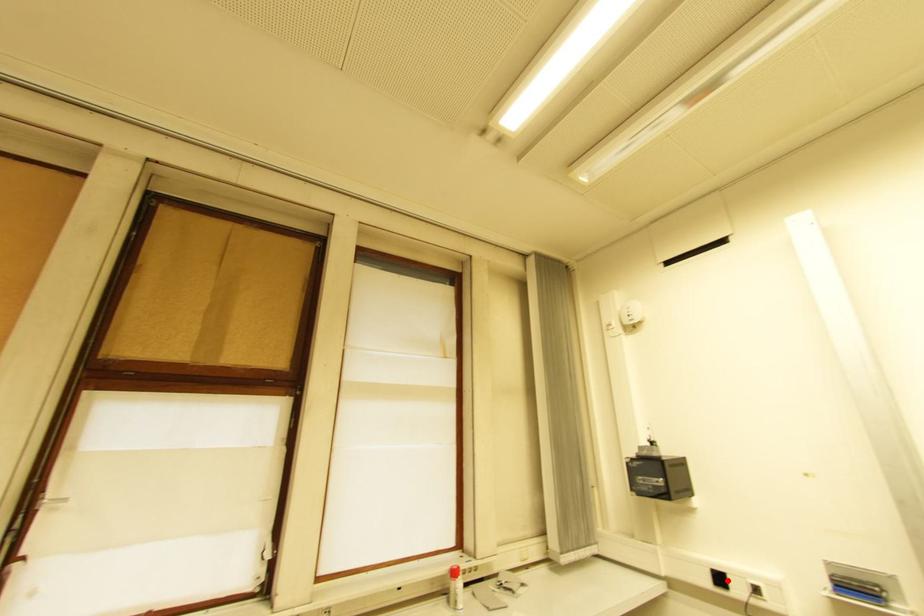
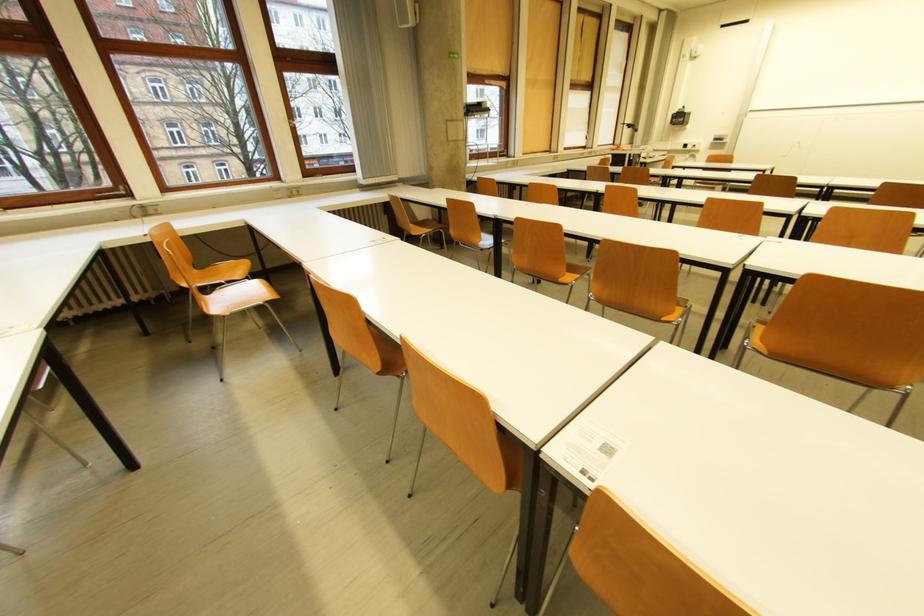
Question: I am providing you with two images of the same scene from different viewpoints. A red point is marked on the first image. Can you still see the location of the red point in image 2?

Choices:
 (A) Yes
 (B) No

Answer: (A)